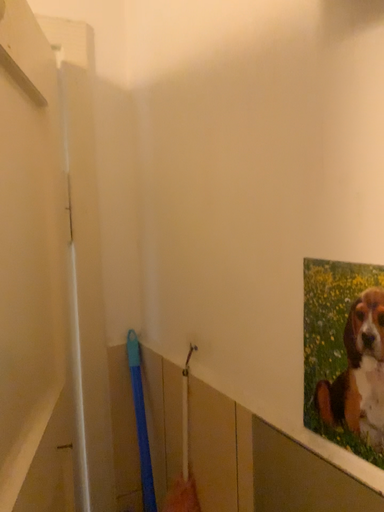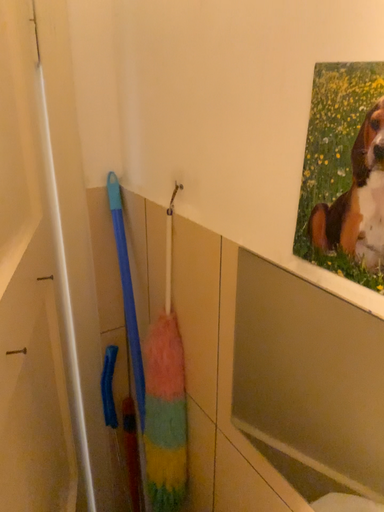
Question: Which way did the camera rotate in the video?

Choices:
 (A) rotated upward
 (B) rotated downward

Answer: (B)